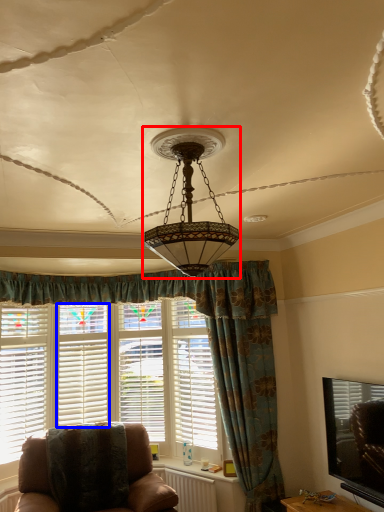
Question: Which point is further to the camera, lamp (highlighted by a red box) or window frame (highlighted by a blue box)?

Choices:
 (A) lamp
 (B) window frame

Answer: (B)